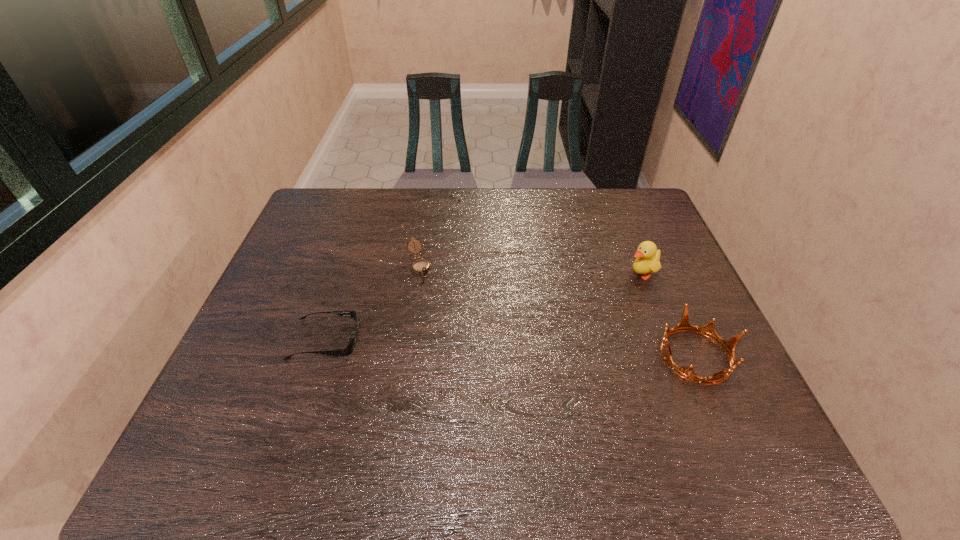
Where is `vacant position at the near edge of the desktop`? This screenshot has width=960, height=540. vacant position at the near edge of the desktop is located at coordinates (295, 401).

Find the location of a particular element. This screenshot has height=540, width=960. free space at the left edge of the desktop is located at coordinates (267, 328).

Identify the location of free region at the right edge of the desktop. This screenshot has width=960, height=540. (647, 235).

Where is `vacant space at the far left corner of the desktop`? vacant space at the far left corner of the desktop is located at coordinates (321, 196).

The height and width of the screenshot is (540, 960). In the image, there is a desktop. In order to click on vacant space at the near left corner in this screenshot , I will do `click(252, 409)`.

Image resolution: width=960 pixels, height=540 pixels. In the image, there is a desktop. What are the coordinates of `vacant space at the far right corner` in the screenshot? It's located at (647, 222).

This screenshot has width=960, height=540. Identify the location of free point between the third tallest object and the tallest object. (530, 269).

The width and height of the screenshot is (960, 540). Find the location of `vacant space in between the crown and the compass`. vacant space in between the crown and the compass is located at coordinates (557, 311).

The width and height of the screenshot is (960, 540). Identify the location of free area in between the second object from left to right and the duckling. (530, 269).

Identify the location of vacant region between the second tallest object and the shortest object. The width and height of the screenshot is (960, 540). [x=511, y=348].